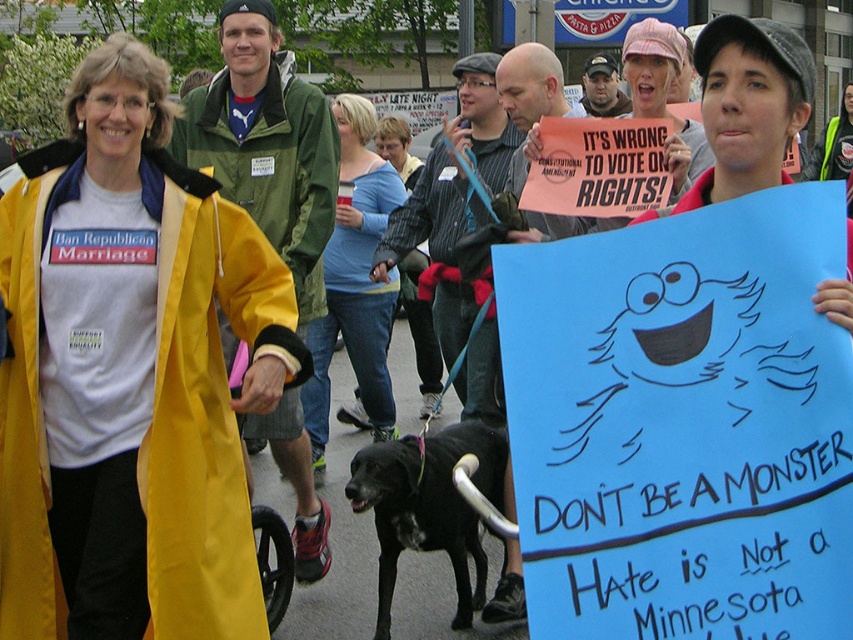
You are a photographer trying to capture a photo of the black fur dog at center and the blue cotton shirt at center. Which object should you focus on first if you want to include both in your shot without moving the camera?

The blue cotton shirt at center is to the left of black fur dog at center, so you should focus on the blue cotton shirt at center first to ensure both are in frame.

You are a photographer trying to capture the protest scene. You want to focus on the blue cotton shirt at center. According to the coordinates provided, where should you aim your camera to capture it?

The blue cotton shirt at center is located at the 2D coordinates point (355, 282), so you should aim your camera at that specific coordinate to capture it.